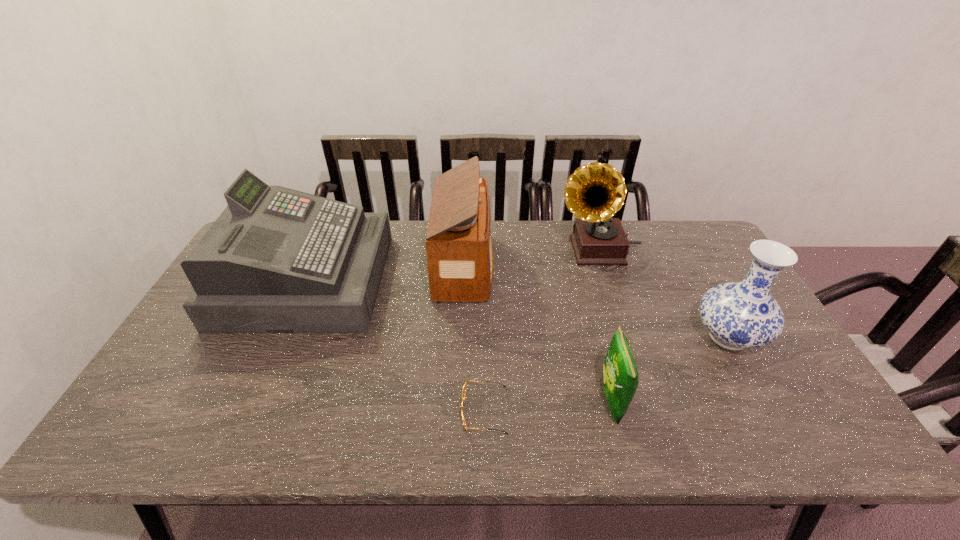
The width and height of the screenshot is (960, 540). I want to click on radio receiver, so click(460, 258).

What are the coordinates of `phonograph record` in the screenshot? It's located at (594, 192).

Identify the location of the leftmost object. This screenshot has width=960, height=540. (277, 260).

Where is `the rightmost object`? the rightmost object is located at coordinates (741, 315).

The image size is (960, 540). In order to click on the fifth tallest object in this screenshot , I will do `click(620, 376)`.

This screenshot has width=960, height=540. I want to click on spectacles, so click(464, 390).

The width and height of the screenshot is (960, 540). In order to click on free spot located 0.100m on the front panel of the radio receiver in this screenshot , I will do `click(525, 266)`.

Where is `vacant space situated from the horn of the phonograph record`? The width and height of the screenshot is (960, 540). vacant space situated from the horn of the phonograph record is located at coordinates (487, 249).

This screenshot has width=960, height=540. Find the location of `vacant space situated from the horn of the phonograph record`. vacant space situated from the horn of the phonograph record is located at coordinates (487, 249).

Locate an element on the screen. Image resolution: width=960 pixels, height=540 pixels. free region located 0.220m from the horn of the phonograph record is located at coordinates (490, 249).